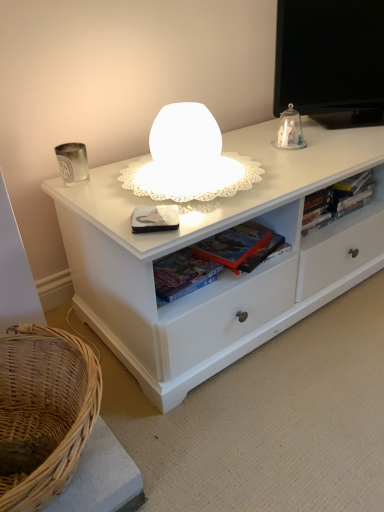
Question: From the image's perspective, is hardcover book at right, the first book when ordered from right to left, positioned above or below white matte paperback book at center?

Choices:
 (A) above
 (B) below

Answer: (A)

Question: From their relative heights in the image, would you say hardcover book at right, which appears as the third book when viewed from the left, is taller or shorter than white matte paperback book at center?

Choices:
 (A) tall
 (B) short

Answer: (A)

Question: Which object is positioned farthest from the hardcover book at center, which ranks as the 1th book in left-to-right order?

Choices:
 (A) woven natural basket at lower left
 (B) hardcover book at right, the first book when ordered from right to left
 (C) hardcover book at center, which appears as the second book when viewed from the left
 (D) clear glass dome at upper right
 (E) white matte paperback book at center

Answer: (D)

Question: Based on their relative distances, which object is nearer to the hardcover book at center, the 3th book viewed from the right?

Choices:
 (A) hardcover book at center, which appears as the second book when viewed from the left
 (B) hardcover book at right, which appears as the third book when viewed from the left
 (C) clear glass dome at upper right
 (D) white matte paperback book at center
 (E) woven natural basket at lower left

Answer: (A)